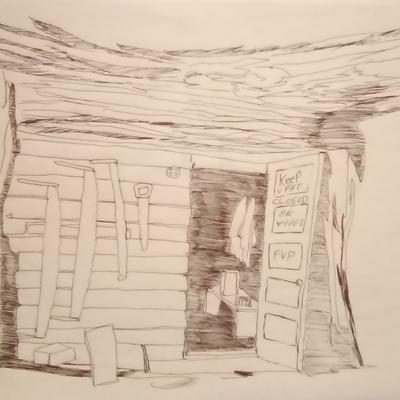
Where is `paneled wall`? This screenshot has height=400, width=400. paneled wall is located at coordinates click(147, 276).